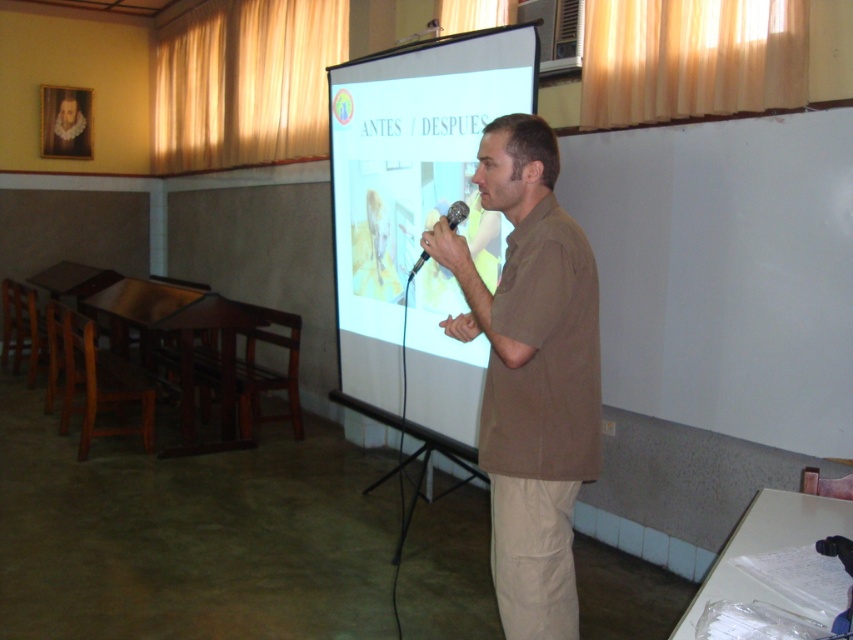
Which is in front, point (596, 332) or point (461, 216)?

Point (596, 332) is in front.

Which of these two, brown cotton shirt at center or black plastic microphone at center, stands taller?

brown cotton shirt at center

Where is `brown cotton shirt at center`? The width and height of the screenshot is (853, 640). brown cotton shirt at center is located at coordinates (531, 374).

Measure the distance between white matte projection screen at center and camera.

9.89 feet

Consider the image. Is white matte projection screen at center above black plastic microphone at center?

Yes.

Who is more forward, (490, 230) or (456, 220)?

Point (456, 220) is in front.

This screenshot has width=853, height=640. Find the location of `white matte projection screen at center`. white matte projection screen at center is located at coordinates (416, 161).

Is brown cotton shirt at center below white matte projection screen at center?

Yes.

Can you confirm if brown cotton shirt at center is bigger than white matte projection screen at center?

No, brown cotton shirt at center is not bigger than white matte projection screen at center.

What do you see at coordinates (531, 374) in the screenshot?
I see `brown cotton shirt at center` at bounding box center [531, 374].

Image resolution: width=853 pixels, height=640 pixels. Find the location of `brown cotton shirt at center`. brown cotton shirt at center is located at coordinates (531, 374).